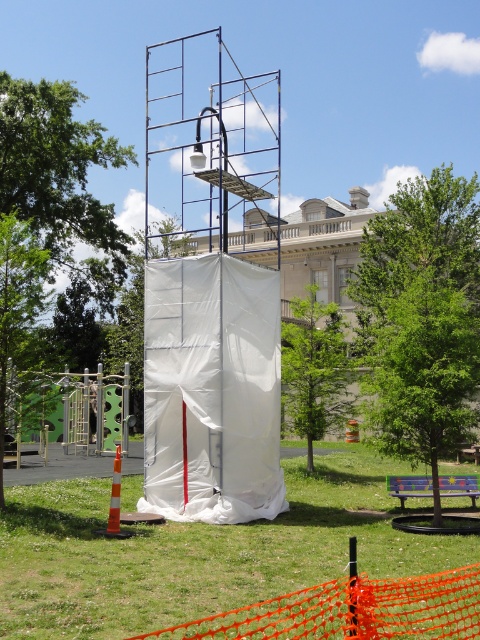
You are a construction worker who needs to place a new safety sign that must be placed on the largest object in the scene. Which object should you choose between the green grass at lower center and the white fabric tent at center?

The green grass at lower center is larger in size than the white fabric tent at center, so you should place the safety sign on the green grass at lower center.

You are a construction worker needing to place a 1.2 meter wide equipment between the green grass at lower center and the orange traffic cone at lower left. Can you fit it there?

The green grass at lower center might be wider than orange traffic cone at lower left, but the exact width isn not specified. Without knowing the exact width of the green grass at lower center, it is uncertain if the 1.2 meter wide equipment can fit between them.